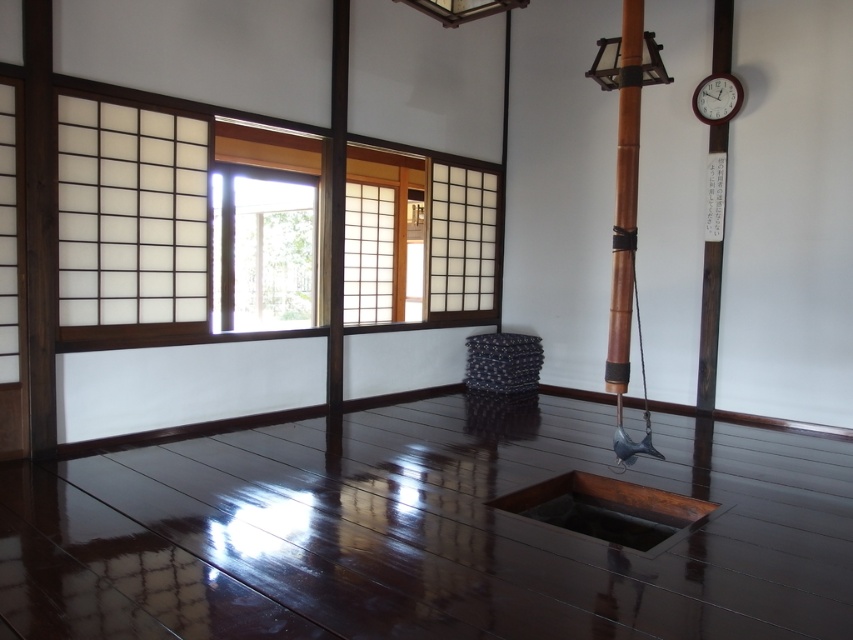
Question: In this image, where is brown polished bamboo pole at upper center located relative to wooden textured lampshade at upper center?

Choices:
 (A) below
 (B) above

Answer: (A)

Question: Which is farther from the white plastic clock at upper right?

Choices:
 (A) brown polished bamboo pole at upper center
 (B) patterned fabric stool at center

Answer: (B)

Question: Among these objects, which one is nearest to the camera?

Choices:
 (A) wooden lantern at upper center
 (B) brown polished bamboo pole at upper center

Answer: (B)

Question: Is the position of brown polished bamboo pole at upper center less distant than that of wooden lantern at upper center?

Choices:
 (A) yes
 (B) no

Answer: (A)

Question: Can you confirm if patterned fabric stool at center is thinner than wooden textured lampshade at upper center?

Choices:
 (A) yes
 (B) no

Answer: (B)

Question: Which object is farther from the camera taking this photo?

Choices:
 (A) wooden textured lampshade at upper center
 (B) patterned fabric stool at center
 (C) white plastic clock at upper right

Answer: (B)